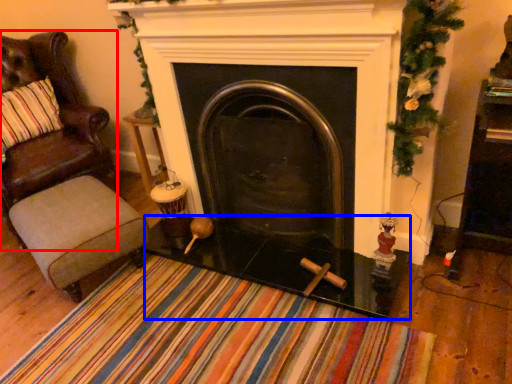
Question: Which object is closer to the camera taking this photo, chair (highlighted by a red box) or glass table (highlighted by a blue box)?

Choices:
 (A) chair
 (B) glass table

Answer: (B)